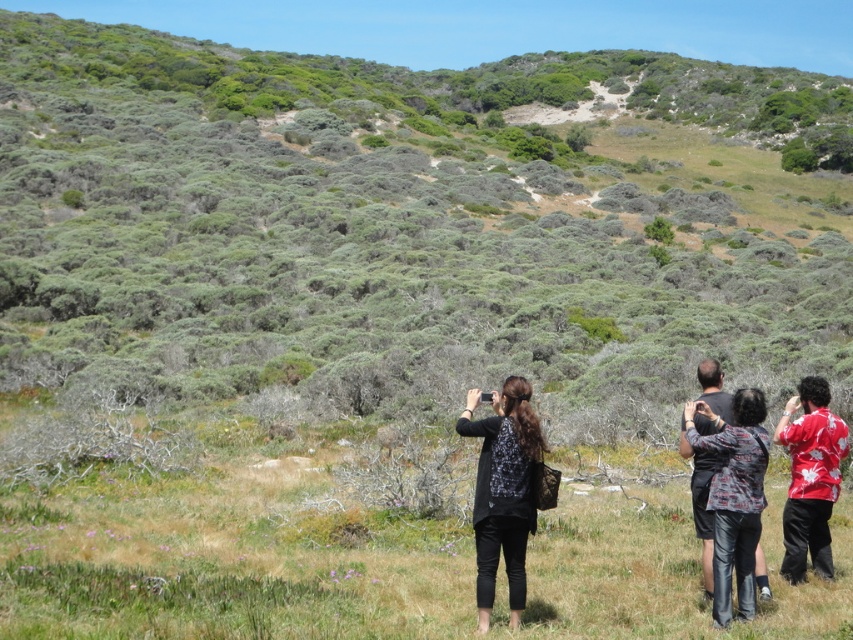
Who is more distant from viewer, (453, 102) or (718, 625)?

Point (453, 102)

Is point (524, 344) behind point (761, 400)?

Yes, it is.

Which is in front, point (583, 54) or point (698, 436)?

Positioned in front is point (698, 436).

Identify the location of green shrubbery at center. The width and height of the screenshot is (853, 640). (408, 218).

Which is more to the left, green grassy at center or black matte jacket at center?

From the viewer's perspective, green grassy at center appears more on the left side.

Can you confirm if green grassy at center is positioned to the left of black matte jacket at center?

Correct, you'll find green grassy at center to the left of black matte jacket at center.

Is point (297, 480) positioned in front of point (492, 445)?

No, (297, 480) is further to viewer.

Find the location of a particular element. Image resolution: width=853 pixels, height=640 pixels. green grassy at center is located at coordinates (231, 556).

Who is more forward, (358, 538) or (788, 529)?

Point (788, 529) is more forward.

Who is shorter, green grassy at center or red hawaiian shirt at right?

Standing shorter between the two is green grassy at center.

Find the location of a particular element. This screenshot has height=640, width=853. green grassy at center is located at coordinates (231, 556).